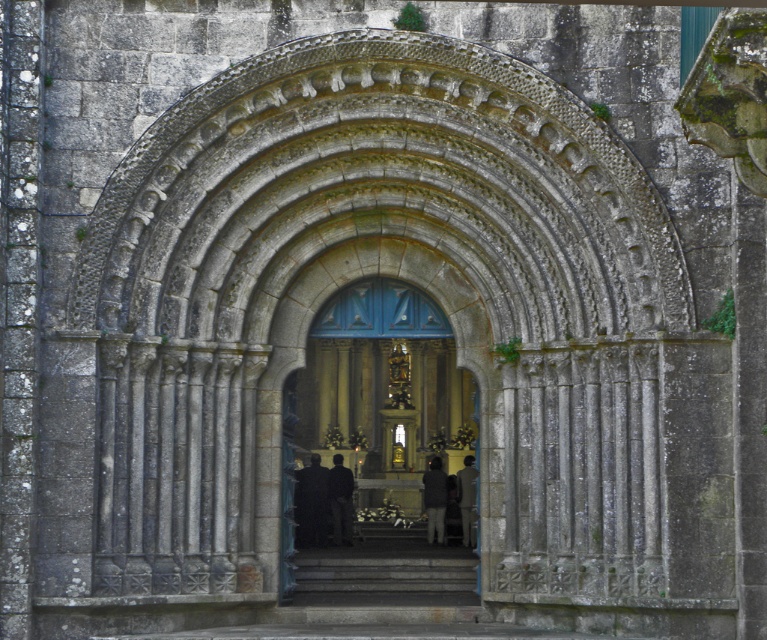
Question: Can you confirm if black fabric at center is thinner than dark fabric coat at center?

Choices:
 (A) yes
 (B) no

Answer: (A)

Question: Can you confirm if blue wooden door at center is positioned above dark gray fabric coat at center?

Choices:
 (A) no
 (B) yes

Answer: (B)

Question: Is black fabric at center wider than dark gray fabric coat at center?

Choices:
 (A) no
 (B) yes

Answer: (B)

Question: Among these points, which one is farthest from the camera?

Choices:
 (A) [x=473, y=483]
 (B) [x=308, y=492]

Answer: (A)

Question: Which object is the farthest from the black fabric at center?

Choices:
 (A) dark gray fabric coat at center
 (B) dark brown leather coat at center

Answer: (B)

Question: Which point is farther to the camera?

Choices:
 (A) black fabric at center
 (B) dark fabric coat at center
 (C) dark gray fabric coat at center
 (D) dark brown leather coat at center

Answer: (C)